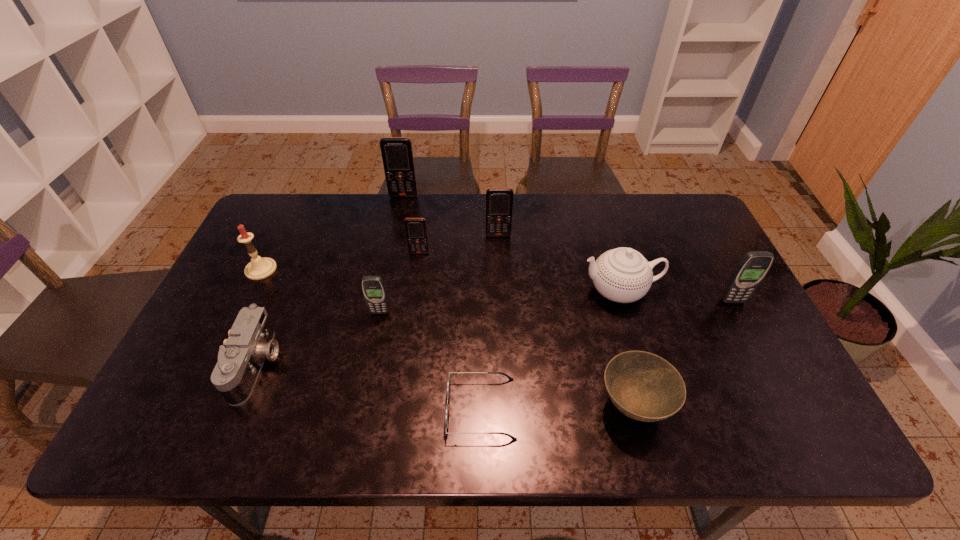
Identify the location of free region located 0.260m on the spout of the chinaware. (488, 291).

At what (x,y) coordinates should I click in order to perform the action: click on vacant space located on the spout of the chinaware. Please return your answer as a coordinate pair (x, y). This screenshot has width=960, height=540. Looking at the image, I should click on (523, 291).

In order to click on blank space located on the spout of the chinaware in this screenshot , I will do (x=544, y=291).

What are the coordinates of `free point located 0.340m on the screen of the second orange cellular telephone from left to right` in the screenshot? It's located at (406, 347).

The width and height of the screenshot is (960, 540). I want to click on vacant space located 0.050m on the screen of the smaller gray cellular telephone, so click(x=376, y=329).

This screenshot has height=540, width=960. What are the coordinates of `free space located on the lens of the camera` in the screenshot? It's located at (344, 364).

Identify the location of free region located on the right of the bowl. The height and width of the screenshot is (540, 960). (737, 406).

Image resolution: width=960 pixels, height=540 pixels. I want to click on free point located 0.330m on the front-facing side of the sunglasses, so pos(300,408).

At what (x,y) coordinates should I click in order to perform the action: click on free point located on the front-facing side of the sunglasses. Please return your answer as a coordinate pair (x, y). The image size is (960, 540). Looking at the image, I should click on (327, 408).

The height and width of the screenshot is (540, 960). I want to click on free region located 0.220m on the front-facing side of the sunglasses, so click(x=349, y=408).